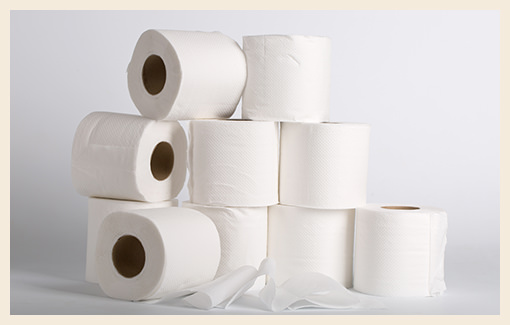
I want to click on rolls of toilet paper, so click(x=216, y=68), click(x=287, y=66), click(x=319, y=163), click(x=221, y=174), click(x=127, y=147), click(x=97, y=206), click(x=162, y=220), click(x=235, y=224), click(x=344, y=240), click(x=393, y=243).